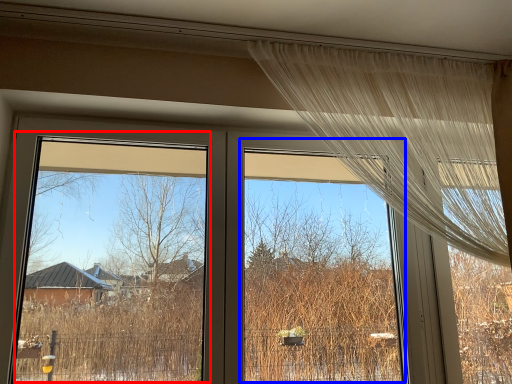
Question: Which object is closer to the camera taking this photo, window screen (highlighted by a red box) or window screen (highlighted by a blue box)?

Choices:
 (A) window screen
 (B) window screen

Answer: (A)